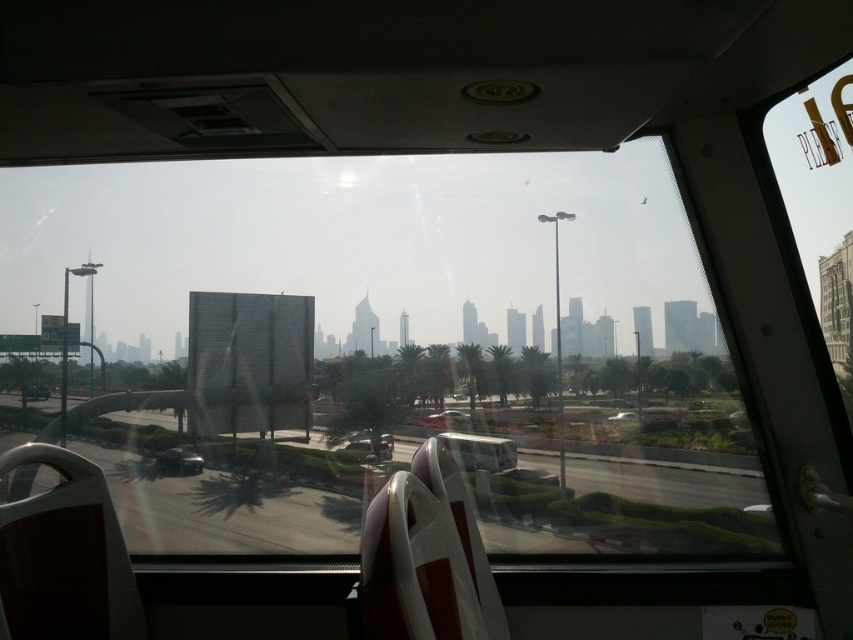
Question: Among these objects, which one is farthest from the camera?

Choices:
 (A) transparent glass train window at center
 (B) metallic silver bus at center

Answer: (B)

Question: Is transparent glass train window at center smaller than metallic silver bus at center?

Choices:
 (A) no
 (B) yes

Answer: (A)

Question: Which of the following is the farthest from the observer?

Choices:
 (A) transparent glass train window at center
 (B) metallic silver bus at center

Answer: (B)

Question: Which object is farther from the camera taking this photo?

Choices:
 (A) metallic silver bus at center
 (B) transparent glass train window at center

Answer: (A)

Question: Considering the relative positions of transparent glass train window at center and metallic silver bus at center in the image provided, where is transparent glass train window at center located with respect to metallic silver bus at center?

Choices:
 (A) below
 (B) above

Answer: (B)

Question: Is transparent glass train window at center thinner than metallic silver bus at center?

Choices:
 (A) no
 (B) yes

Answer: (A)